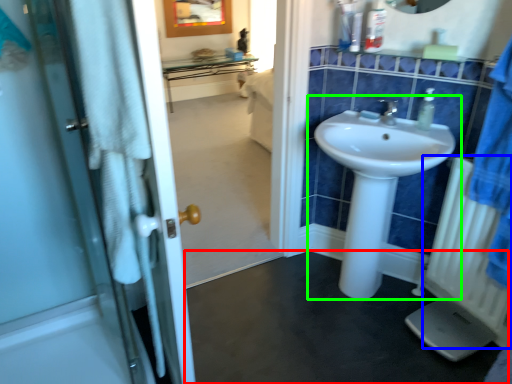
Question: Which object is the closest to the plain (highlighted by a red box)? Choose among these: radiator (highlighted by a blue box) or sink (highlighted by a green box).

Choices:
 (A) radiator
 (B) sink

Answer: (B)